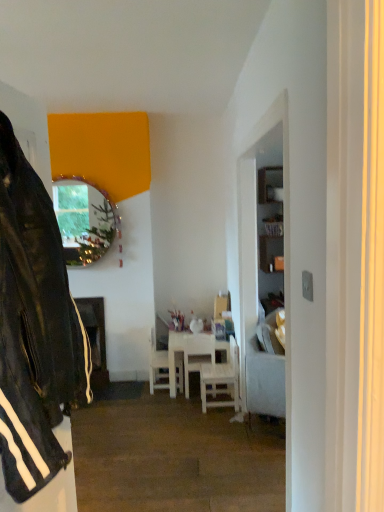
Find the location of `space that is in front of white wooden chair at center, which is the 1th chair from right to left`. space that is in front of white wooden chair at center, which is the 1th chair from right to left is located at coordinates (207, 419).